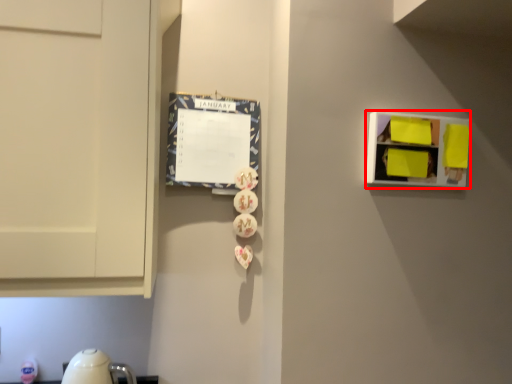
Question: From the image's perspective, where is shelf (annotated by the red box) located relative to bulletin board?

Choices:
 (A) below
 (B) above

Answer: (A)